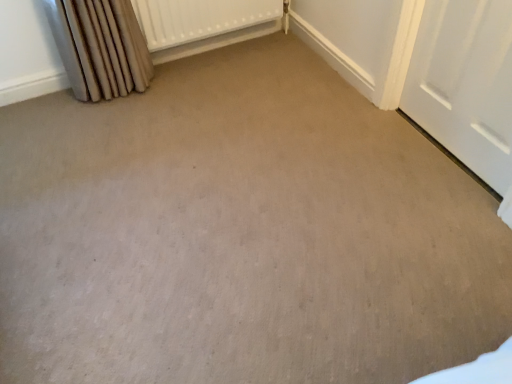
Where is `free space below white matte door at right (from a real-world perspective)`? The image size is (512, 384). free space below white matte door at right (from a real-world perspective) is located at coordinates (440, 143).